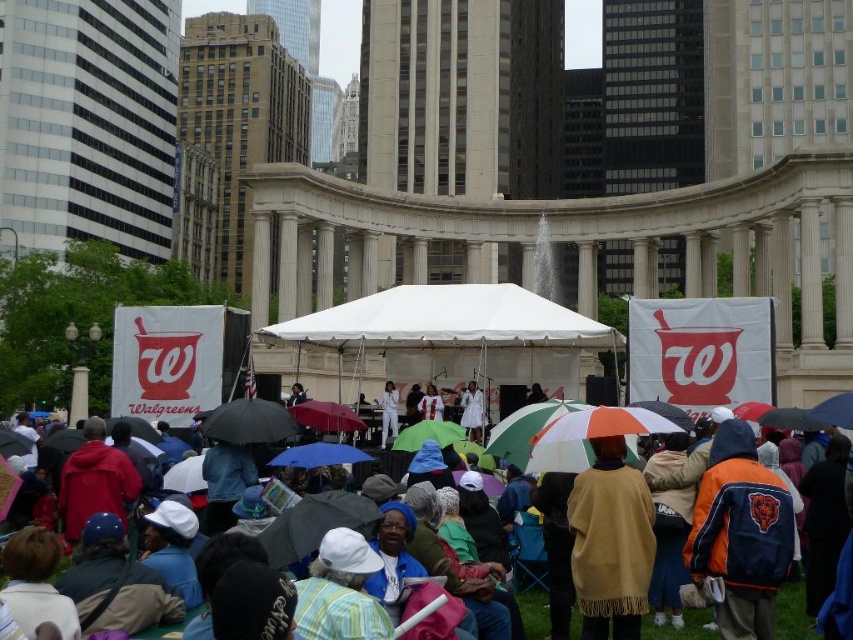
Question: Among these points, which one is farthest from the camera?

Choices:
 (A) pyautogui.click(x=315, y=403)
 (B) pyautogui.click(x=444, y=442)

Answer: (A)

Question: Which point appears farthest from the camera in this image?

Choices:
 (A) (747, 445)
 (B) (412, 449)

Answer: (B)

Question: In this image, where is orange fabric jacket at lower right located relative to blue fabric umbrella at center?

Choices:
 (A) above
 (B) below

Answer: (B)

Question: Is orange fabric jacket at lower right above blue fabric umbrella at center?

Choices:
 (A) yes
 (B) no

Answer: (B)

Question: Which point is farther to the camera?

Choices:
 (A) green matte umbrella at center
 (B) orange fabric jacket at lower right
 (C) blue fabric umbrella at center
 (D) tan wool poncho at center

Answer: (A)

Question: Is tan wool poncho at center below blue fabric umbrella at center?

Choices:
 (A) no
 (B) yes

Answer: (A)